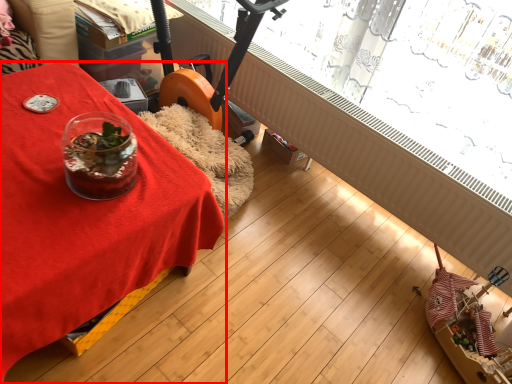
Question: From the image's perspective, what is the correct spatial positioning of table (annotated by the red box) in reference to bay window?

Choices:
 (A) above
 (B) below

Answer: (B)